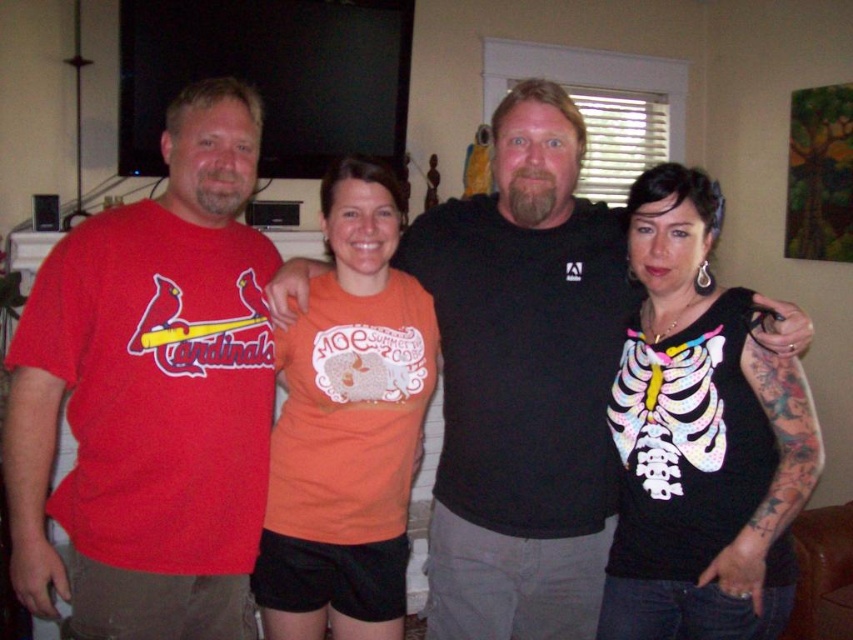
Question: Based on their relative distances, which object is nearer to the orange cotton t-shirt at center?

Choices:
 (A) black matte shirt at center
 (B) black fabric skeleton shirt at right
 (C) matte red t-shirt at left

Answer: (A)

Question: Which object is positioned farthest from the matte red t-shirt at left?

Choices:
 (A) black matte shirt at center
 (B) orange cotton t-shirt at center
 (C) black fabric skeleton shirt at right

Answer: (C)

Question: Considering the relative positions of black matte shirt at center and black fabric skeleton shirt at right in the image provided, where is black matte shirt at center located with respect to black fabric skeleton shirt at right?

Choices:
 (A) left
 (B) right

Answer: (A)

Question: Observing the image, what is the correct spatial positioning of matte red t-shirt at left in reference to black fabric skeleton shirt at right?

Choices:
 (A) left
 (B) right

Answer: (A)

Question: Which of the following is the farthest from the observer?

Choices:
 (A) matte red t-shirt at left
 (B) black matte shirt at center
 (C) black fabric skeleton shirt at right
 (D) orange cotton t-shirt at center

Answer: (D)

Question: Does black fabric skeleton shirt at right have a smaller size compared to orange cotton t-shirt at center?

Choices:
 (A) yes
 (B) no

Answer: (A)